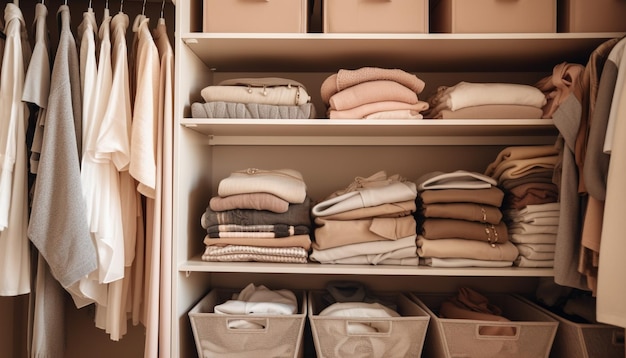
Where is `clothes folded on shelves to the left`? clothes folded on shelves to the left is located at coordinates (x=265, y=79), (x=267, y=93), (x=268, y=105), (x=275, y=181), (x=255, y=200), (x=253, y=215), (x=250, y=224), (x=245, y=238), (x=248, y=248), (x=247, y=253).